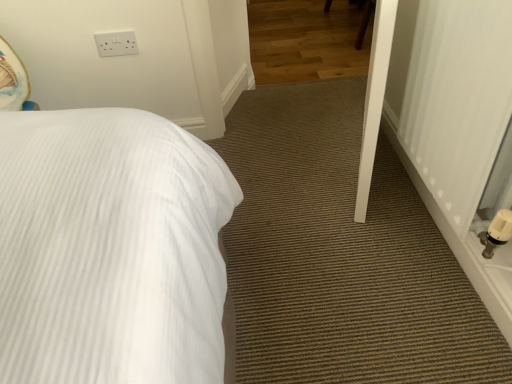
This screenshot has height=384, width=512. In order to click on white plastic electric outlet at upper left in this screenshot , I will do `click(116, 43)`.

This screenshot has width=512, height=384. What do you see at coordinates (116, 43) in the screenshot?
I see `white plastic electric outlet at upper left` at bounding box center [116, 43].

This screenshot has height=384, width=512. Find the location of `white plastic radiator at right`. white plastic radiator at right is located at coordinates (458, 99).

In order to face white plastic radiator at right, should I rotate leftwards or rightwards?

Rotate right and turn 27.496 degrees.

The height and width of the screenshot is (384, 512). Describe the element at coordinates (458, 99) in the screenshot. I see `white plastic radiator at right` at that location.

Locate an element on the screen. Image resolution: width=512 pixels, height=384 pixels. white plastic electric outlet at upper left is located at coordinates click(x=116, y=43).

Between white plastic electric outlet at upper left and white plastic radiator at right, which one appears on the right side from the viewer's perspective?

Positioned to the right is white plastic radiator at right.

Which object is more forward, white plastic electric outlet at upper left or white plastic radiator at right?

white plastic radiator at right is more forward.

Is point (121, 52) closer to camera compared to point (492, 77)?

No, it is not.

From the image's perspective, which one is positioned lower, white plastic electric outlet at upper left or white plastic radiator at right?

white plastic radiator at right appears lower in the image.

From a real-world perspective, is white plastic electric outlet at upper left above or below white plastic radiator at right?

white plastic electric outlet at upper left is situated lower than white plastic radiator at right in the real world.

Considering the relative sizes of white plastic electric outlet at upper left and white plastic radiator at right in the image provided, is white plastic electric outlet at upper left wider than white plastic radiator at right?

No.

Between white plastic electric outlet at upper left and white plastic radiator at right, which one has less height?

With less height is white plastic electric outlet at upper left.

Considering the sizes of objects white plastic electric outlet at upper left and white plastic radiator at right in the image provided, who is bigger, white plastic electric outlet at upper left or white plastic radiator at right?

With larger size is white plastic radiator at right.

Is white plastic radiator at right surrounded by white plastic electric outlet at upper left?

Actually, white plastic radiator at right is outside white plastic electric outlet at upper left.

Is white plastic electric outlet at upper left positioned far away from white plastic radiator at right?

Yes.

Does white plastic electric outlet at upper left turn towards white plastic radiator at right?

No, white plastic electric outlet at upper left is not turned towards white plastic radiator at right.

Where is `electric outlet located underneath the white plastic radiator at right (from a real-world perspective)`? This screenshot has height=384, width=512. electric outlet located underneath the white plastic radiator at right (from a real-world perspective) is located at coordinates (116, 43).

Is white plastic radiator at right to the right of white plastic electric outlet at upper left from the viewer's perspective?

Indeed, white plastic radiator at right is positioned on the right side of white plastic electric outlet at upper left.

Is the position of white plastic radiator at right less distant than that of white plastic electric outlet at upper left?

Yes, it is in front of white plastic electric outlet at upper left.

Is point (461, 225) closer or farther from the camera than point (113, 55)?

Point (461, 225) appears to be closer to the viewer than point (113, 55).

From the image's perspective, does white plastic radiator at right appear higher than white plastic electric outlet at upper left?

No, from the image's perspective, white plastic radiator at right is not over white plastic electric outlet at upper left.

From a real-world perspective, between white plastic radiator at right and white plastic electric outlet at upper left, who is vertically higher?

From a 3D spatial view, white plastic radiator at right is above.

Does white plastic radiator at right have a lesser width compared to white plastic electric outlet at upper left?

In fact, white plastic radiator at right might be wider than white plastic electric outlet at upper left.

Who is shorter, white plastic radiator at right or white plastic electric outlet at upper left?

white plastic electric outlet at upper left is shorter.

Can you confirm if white plastic radiator at right is smaller than white plastic electric outlet at upper left?

No, white plastic radiator at right is not smaller than white plastic electric outlet at upper left.

Can white plastic electric outlet at upper left be found inside white plastic radiator at right?

Definitely not — white plastic electric outlet at upper left is not inside white plastic radiator at right.

Is white plastic radiator at right in contact with white plastic electric outlet at upper left?

white plastic radiator at right is not next to white plastic electric outlet at upper left, and they're not touching.

Is white plastic radiator at right oriented towards white plastic electric outlet at upper left?

No, white plastic radiator at right is not oriented towards white plastic electric outlet at upper left.

Can you tell me how much white plastic radiator at right and white plastic electric outlet at upper left differ in facing direction?

The angular difference between white plastic radiator at right and white plastic electric outlet at upper left is 90.1 degrees.

The width and height of the screenshot is (512, 384). In order to click on screen door located above the white plastic electric outlet at upper left (from a real-world perspective) in this screenshot , I will do `click(458, 99)`.

Locate an element on the screen. This screenshot has width=512, height=384. electric outlet that is behind the white plastic radiator at right is located at coordinates (116, 43).

You are a GUI agent. You are given a task and a screenshot of the screen. Output one action in this format:
    pyautogui.click(x=<x>, y=<y>)
    Task: Click on the electric outlet above the white plastic radiator at right (from the image's perspective)
    The image size is (512, 384).
    Given the screenshot: What is the action you would take?
    pyautogui.click(x=116, y=43)